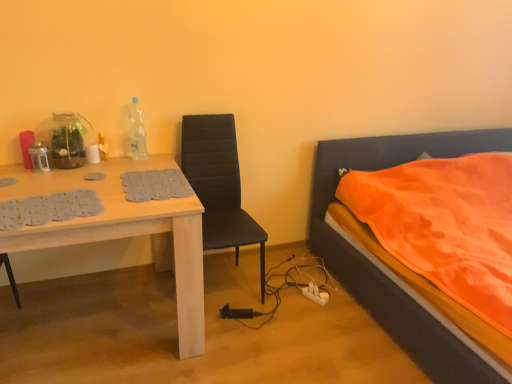
At what (x,y) coordinates should I click in order to perform the action: click on free space in front of white plastic power outlet at lower center. Please return your answer as a coordinate pair (x, y). This screenshot has width=512, height=384. Looking at the image, I should click on (320, 317).